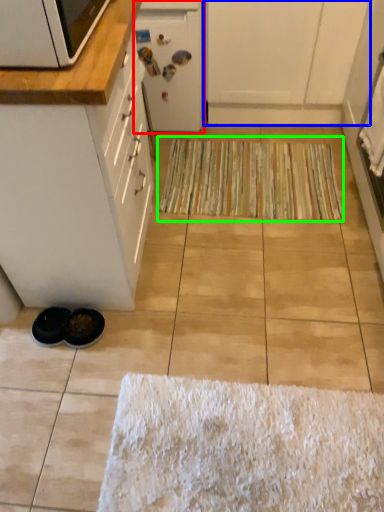
Question: Considering the real-world distances, which object is farthest from appliance (highlighted by a red box)? cabinetry (highlighted by a blue box) or doormat (highlighted by a green box)?

Choices:
 (A) cabinetry
 (B) doormat

Answer: (B)